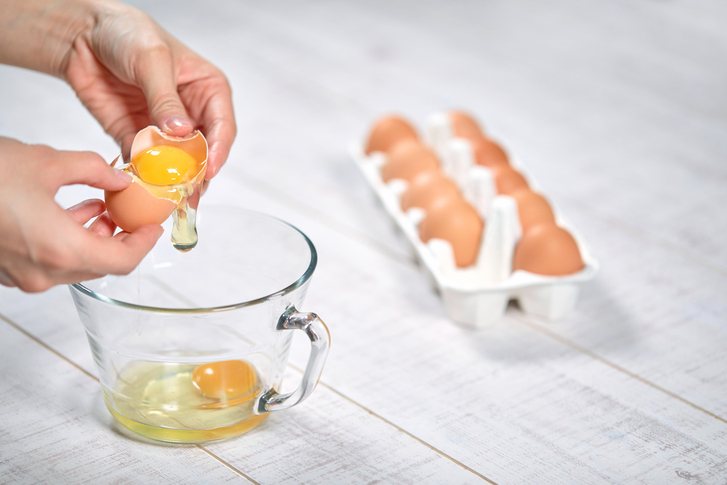
Identify the location of cup handle. (320, 339).